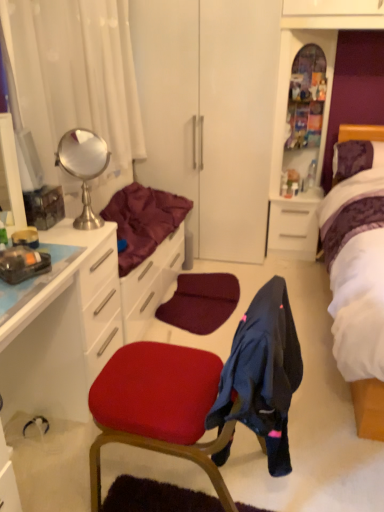
This screenshot has height=512, width=384. Find the location of `free space in front of polished silver mirror at upper left`. free space in front of polished silver mirror at upper left is located at coordinates (79, 237).